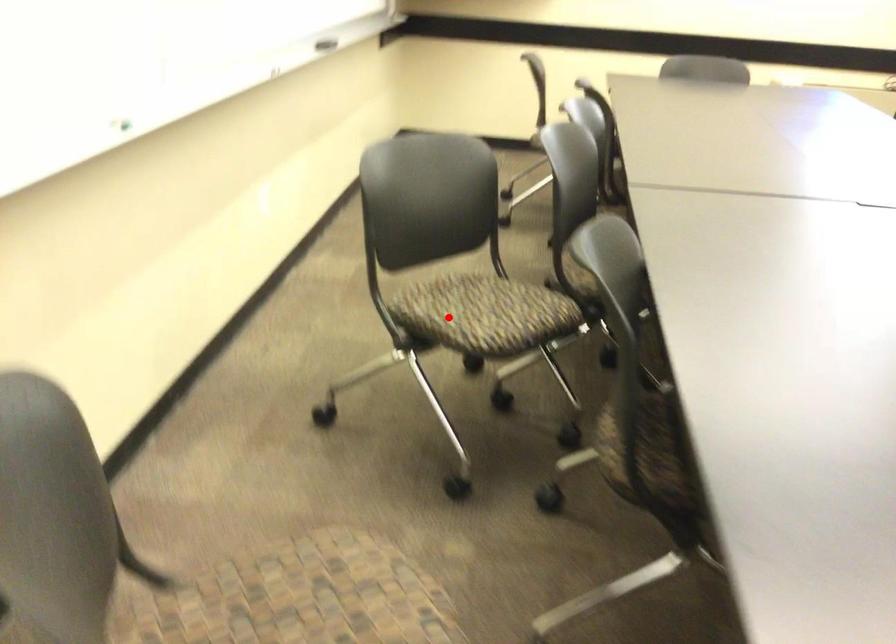
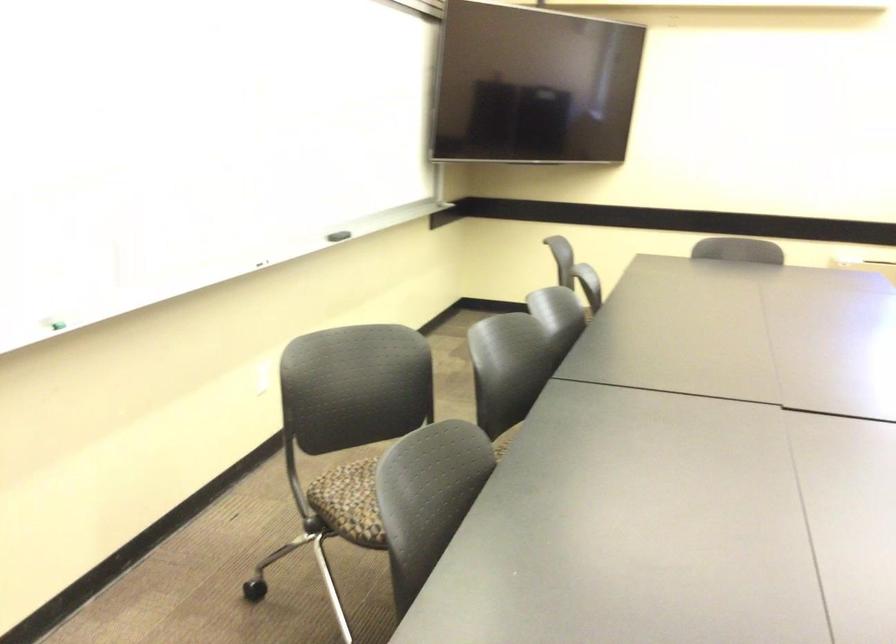
Where in the second image is the point corresponding to the highlighted location from the first image?

(350, 502)